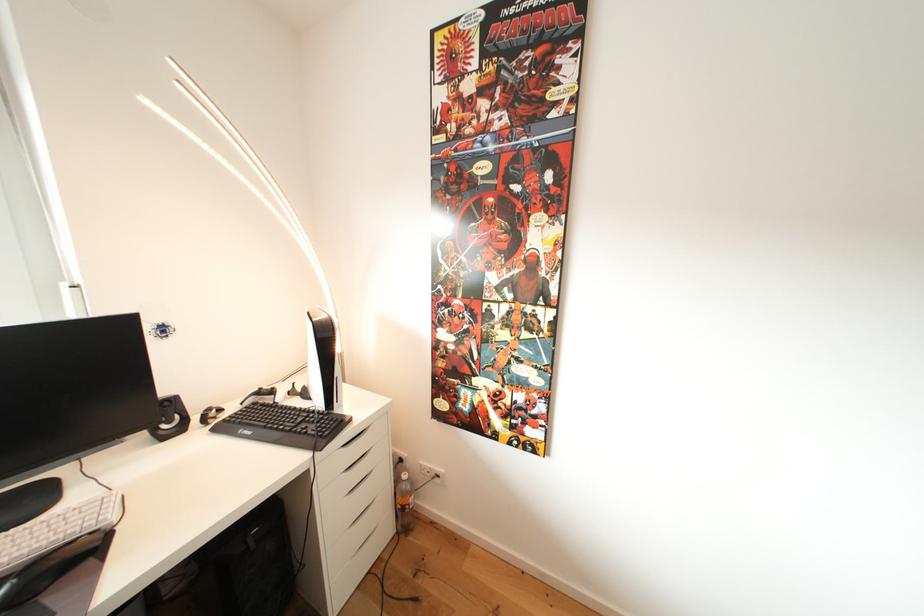
Where would you lift the plastic bottle? Please return your answer as a coordinate pair (x, y).

(404, 501)